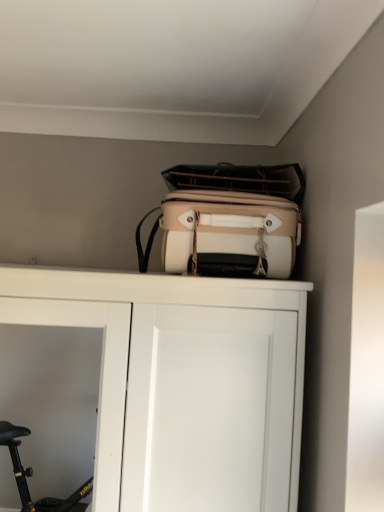
Question: Considering the positions of beige fabric suitcase at upper center and white matte cupboard at upper center in the image, is beige fabric suitcase at upper center bigger or smaller than white matte cupboard at upper center?

Choices:
 (A) small
 (B) big

Answer: (A)

Question: From a real-world perspective, is beige fabric suitcase at upper center physically located above or below white matte cupboard at upper center?

Choices:
 (A) below
 (B) above

Answer: (B)

Question: Is point (291, 226) positioned closer to the camera than point (279, 344)?

Choices:
 (A) closer
 (B) farther

Answer: (B)

Question: Is white matte cupboard at upper center in front of or behind beige fabric suitcase at upper center in the image?

Choices:
 (A) behind
 (B) front

Answer: (B)

Question: In the image, is white matte cupboard at upper center on the left side or the right side of beige fabric suitcase at upper center?

Choices:
 (A) left
 (B) right

Answer: (A)

Question: Is point (271, 436) closer or farther from the camera than point (246, 214)?

Choices:
 (A) closer
 (B) farther

Answer: (A)

Question: From the image's perspective, relative to beige fabric suitcase at upper center, is white matte cupboard at upper center above or below?

Choices:
 (A) above
 (B) below

Answer: (B)